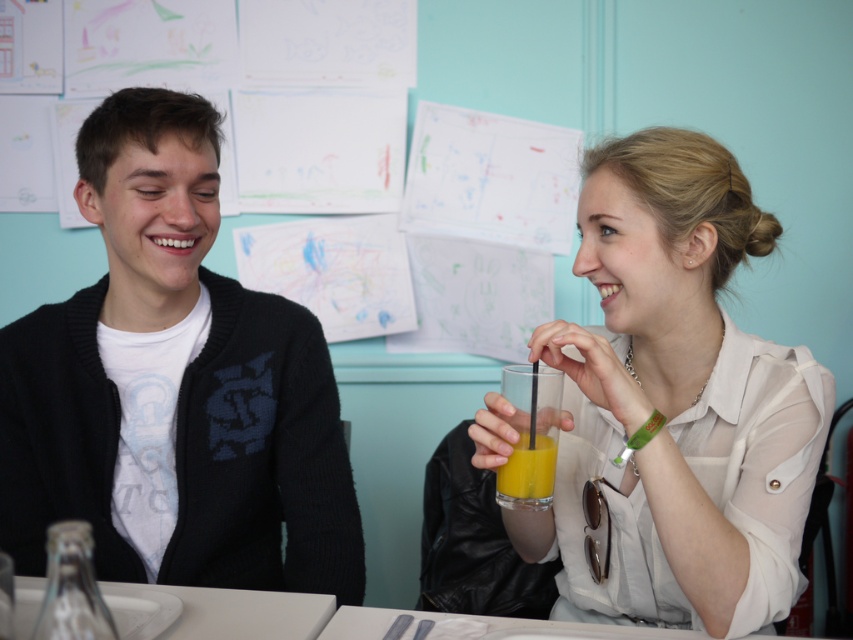
Question: Which object is farther from the camera taking this photo?

Choices:
 (A) white glossy table at lower center
 (B) translucent glass at upper center
 (C) black matte sweater at left
 (D) translucent glass of orange juice at center

Answer: (C)

Question: Is the position of black matte sweater at left less distant than that of translucent glass at upper center?

Choices:
 (A) no
 (B) yes

Answer: (A)

Question: Can you confirm if black matte sweater at left is positioned to the right of white glossy table at lower center?

Choices:
 (A) no
 (B) yes

Answer: (A)

Question: Which object appears closest to the camera in this image?

Choices:
 (A) white glossy table at lower center
 (B) matte white blouse at center
 (C) translucent glass at upper center
 (D) black matte sweater at left

Answer: (A)

Question: Which is nearer to the matte white blouse at center?

Choices:
 (A) translucent glass at upper center
 (B) translucent glass of orange juice at center
 (C) white glossy table at lower center
 (D) black matte sweater at left

Answer: (A)

Question: Is black matte sweater at left to the left of white glossy table at lower center from the viewer's perspective?

Choices:
 (A) yes
 (B) no

Answer: (A)